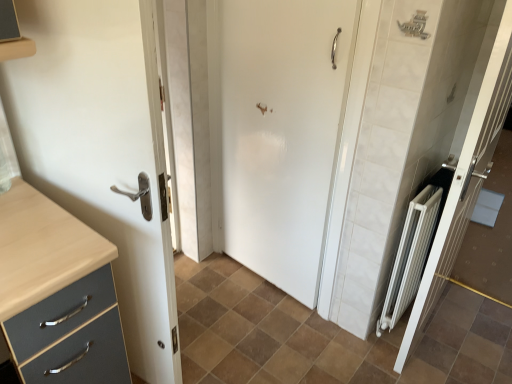
The height and width of the screenshot is (384, 512). Identify the location of free space to the left of white matte door at center, arranged as the 2th door when viewed from the left. (x=216, y=284).